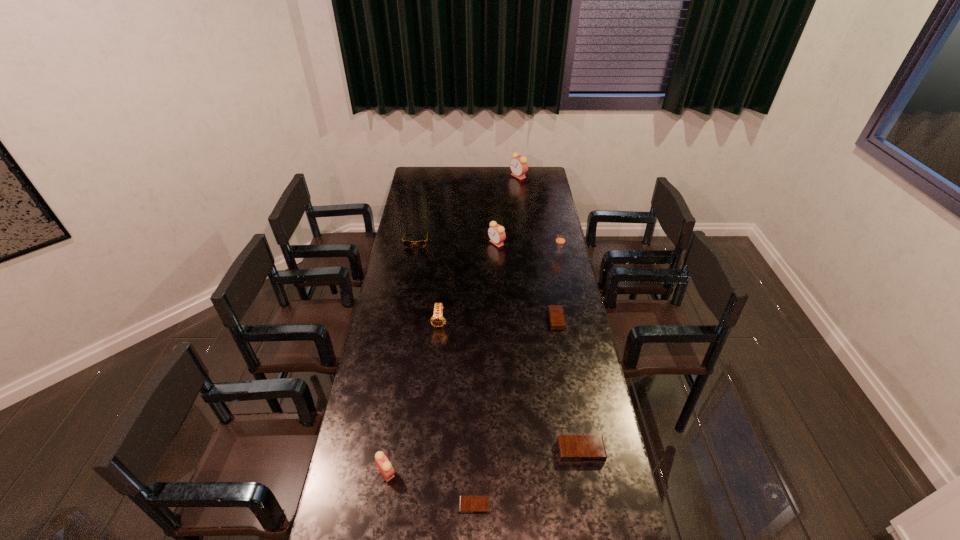
Locate an element on the screen. The image size is (960, 540). vacant space that's between the third alarm clock from left to right and the seventh tallest object is located at coordinates (539, 347).

Image resolution: width=960 pixels, height=540 pixels. I want to click on empty space between the sixth tallest object and the farthest alarm clock, so click(468, 208).

Find the location of `vacant region between the farthest alarm clock and the leftmost black alarm clock`. vacant region between the farthest alarm clock and the leftmost black alarm clock is located at coordinates (496, 341).

Where is `vacant area that lies between the second biggest black alarm clock and the fifth object from right to left`? The width and height of the screenshot is (960, 540). vacant area that lies between the second biggest black alarm clock and the fifth object from right to left is located at coordinates (526, 281).

Where is `free space that is in between the nearest pink alarm clock and the leftmost black alarm clock`? The height and width of the screenshot is (540, 960). free space that is in between the nearest pink alarm clock and the leftmost black alarm clock is located at coordinates (430, 489).

Find the location of `free spot between the fourth shortest object and the fourth shortest alarm clock`. free spot between the fourth shortest object and the fourth shortest alarm clock is located at coordinates (401, 356).

Locate an element on the screen. The height and width of the screenshot is (540, 960). free space between the straw and the watch is located at coordinates (499, 288).

The image size is (960, 540). Identify the location of vacant space that's between the second smallest pink alarm clock and the biggest black alarm clock. (539, 347).

Identify the location of vacant space that is in between the sunglasses and the watch. pos(428,281).

The height and width of the screenshot is (540, 960). I want to click on free space between the seventh object from right to left and the second biggest black alarm clock, so click(x=498, y=321).